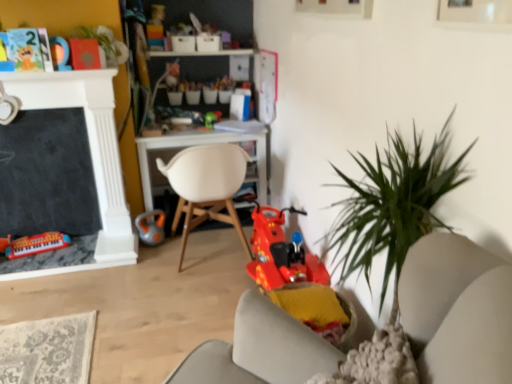
The width and height of the screenshot is (512, 384). In order to click on vacant space that's between orange rubber kettlebell at center, placed as the third toy when sorted from left to right, and shiny plastic scooter at center, the 1th toy when ordered from right to left in this screenshot , I will do `click(204, 258)`.